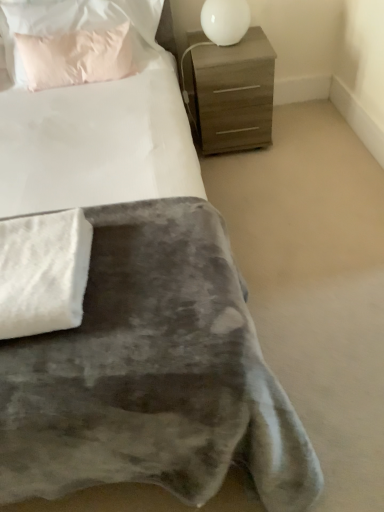
The height and width of the screenshot is (512, 384). Identify the location of free space in front of white fluffy blanket at lower left. [64, 369].